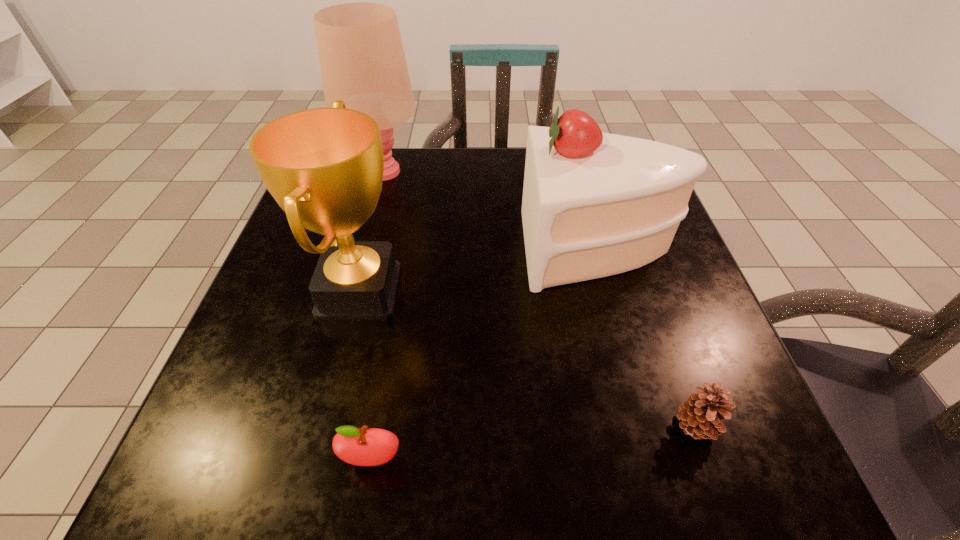
I want to click on the farthest object, so click(x=362, y=61).

What are the coordinates of `award` in the screenshot? It's located at (324, 167).

The image size is (960, 540). I want to click on cake, so click(x=594, y=204).

Where is `apple`? Image resolution: width=960 pixels, height=540 pixels. apple is located at coordinates (362, 447).

Where is `pinecone`? pinecone is located at coordinates (701, 414).

Find the location of `vacant space located on the front of the farthest object`. vacant space located on the front of the farthest object is located at coordinates (356, 271).

Identify the location of free space located 0.120m on the front-facing side of the award. (471, 290).

Where is `free space located 0.210m on the left of the cake`? This screenshot has height=540, width=960. free space located 0.210m on the left of the cake is located at coordinates (420, 248).

Locate an element on the screen. free space located on the back of the apple is located at coordinates (405, 264).

I want to click on vacant space located 0.230m on the back of the pinecone, so click(647, 290).